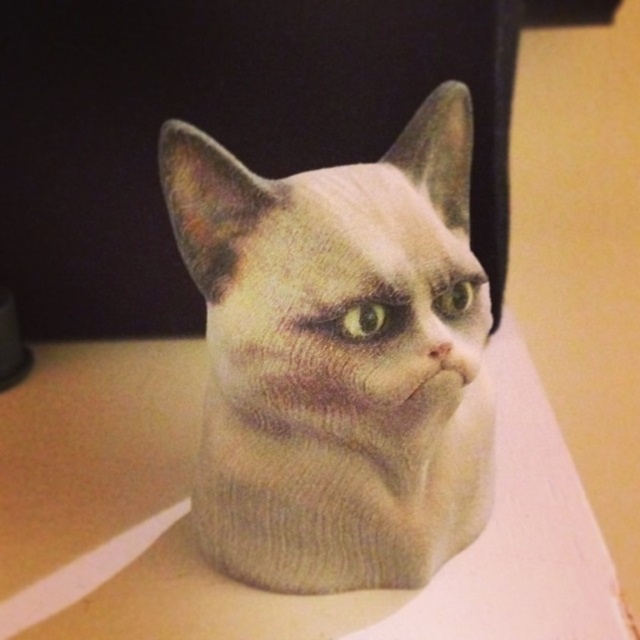
Looking at this image, who is taller, fuzzy beige cat at center or white matte table at center?

With more height is fuzzy beige cat at center.

Does fuzzy beige cat at center appear on the left side of white matte table at center?

No, fuzzy beige cat at center is not to the left of white matte table at center.

Identify the location of fuzzy beige cat at center. (339, 356).

Identify the location of fuzzy beige cat at center. Image resolution: width=640 pixels, height=640 pixels. (339, 356).